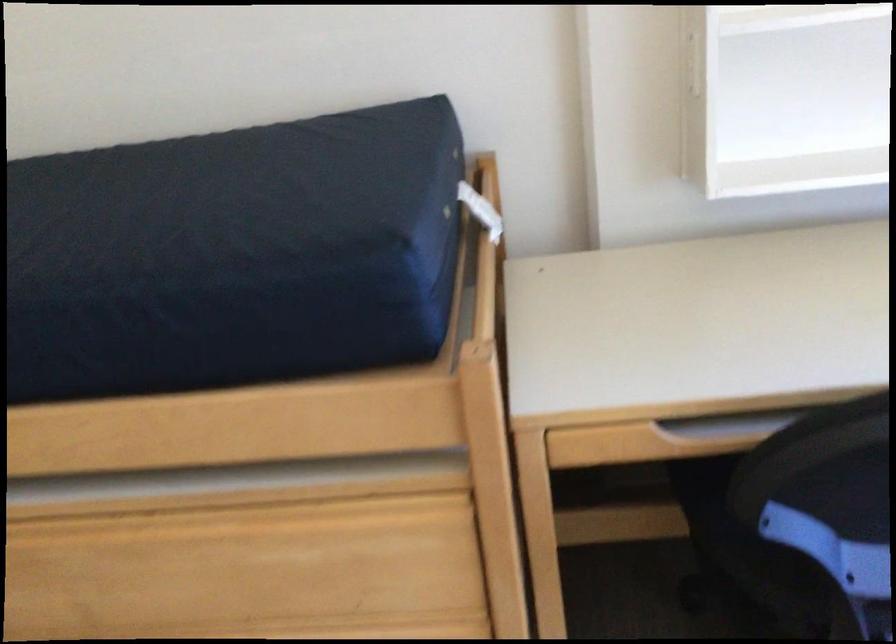
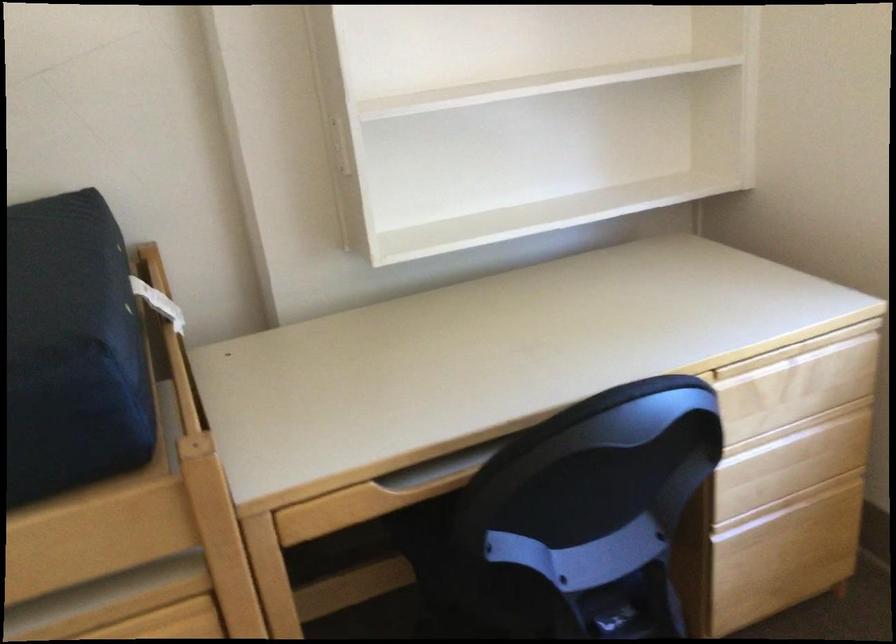
Question: The first image is from the beginning of the video and the second image is from the end. How did the camera likely rotate when shooting the video?

Choices:
 (A) Left
 (B) Right
 (C) Up
 (D) Down

Answer: (B)